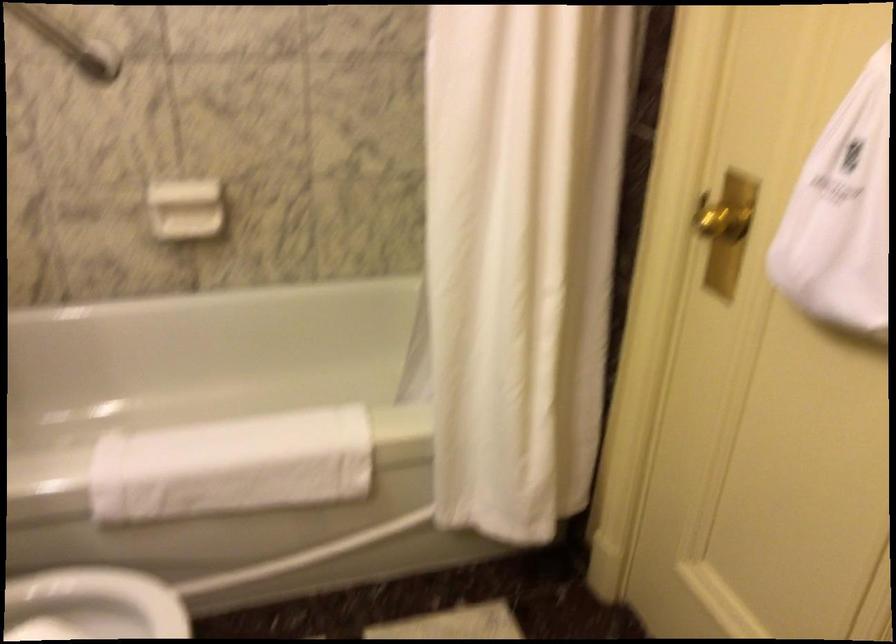
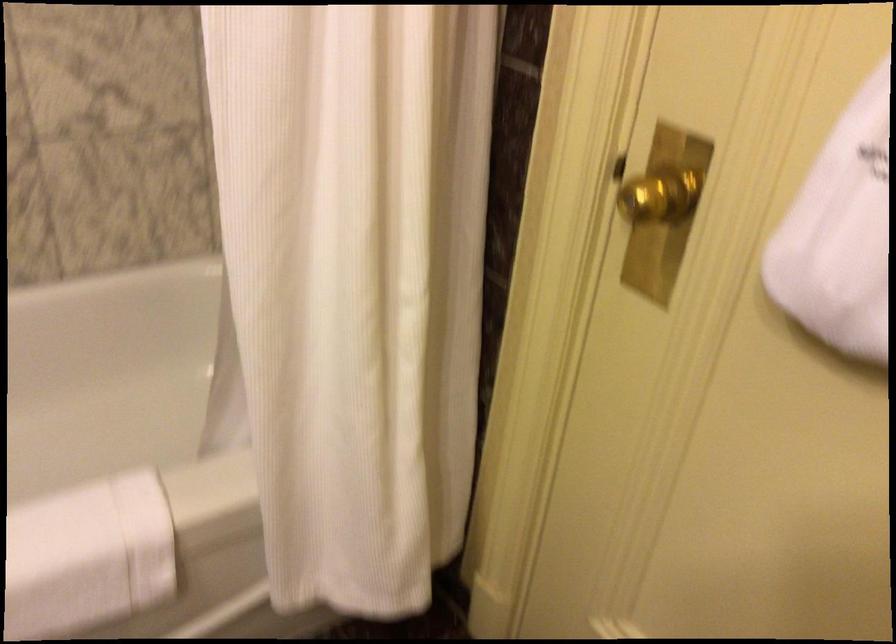
Question: What movement of the cameraman would produce the second image?

Choices:
 (A) Left
 (B) Right
 (C) Forward
 (D) Backward

Answer: (C)